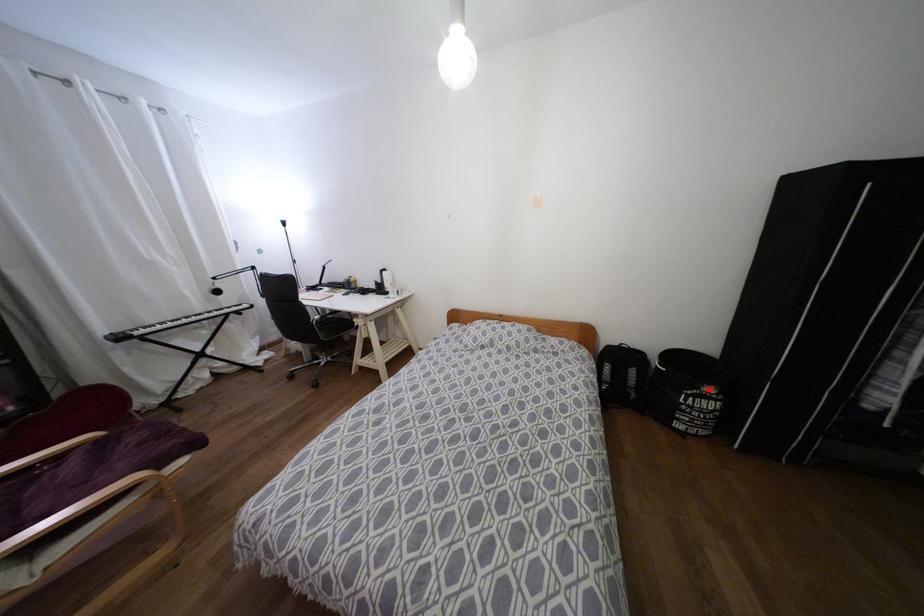
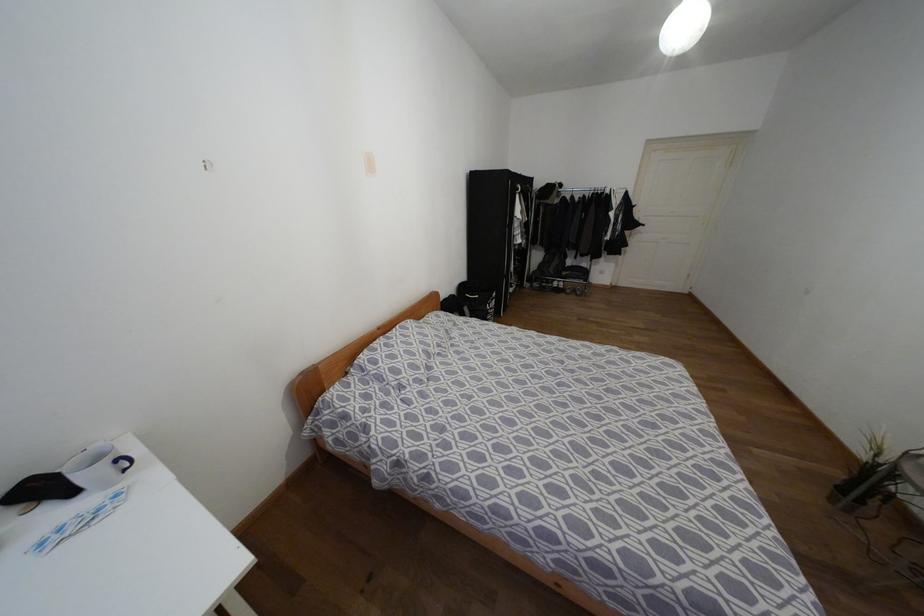
Find the pixel in the second image that matches the highlighted location in the first image.

(493, 294)